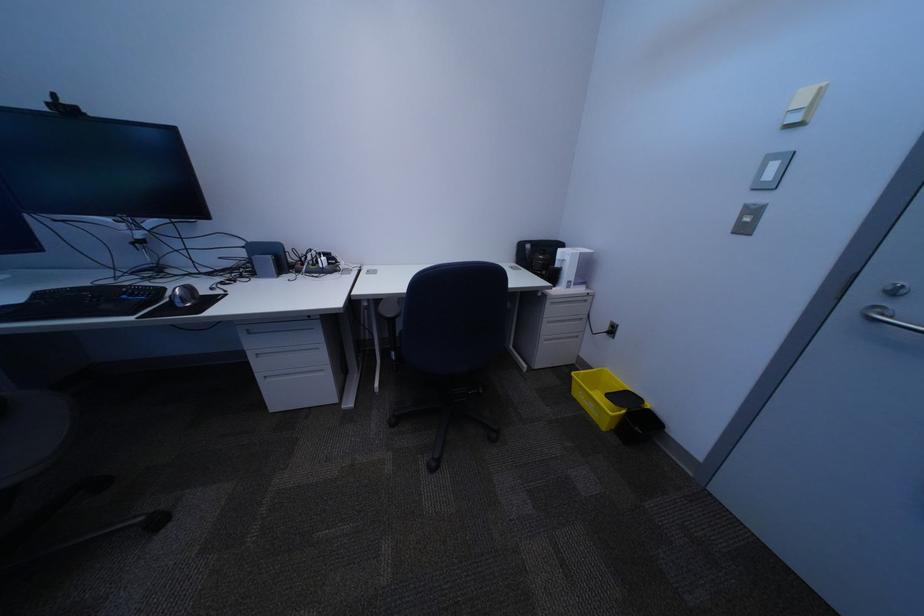
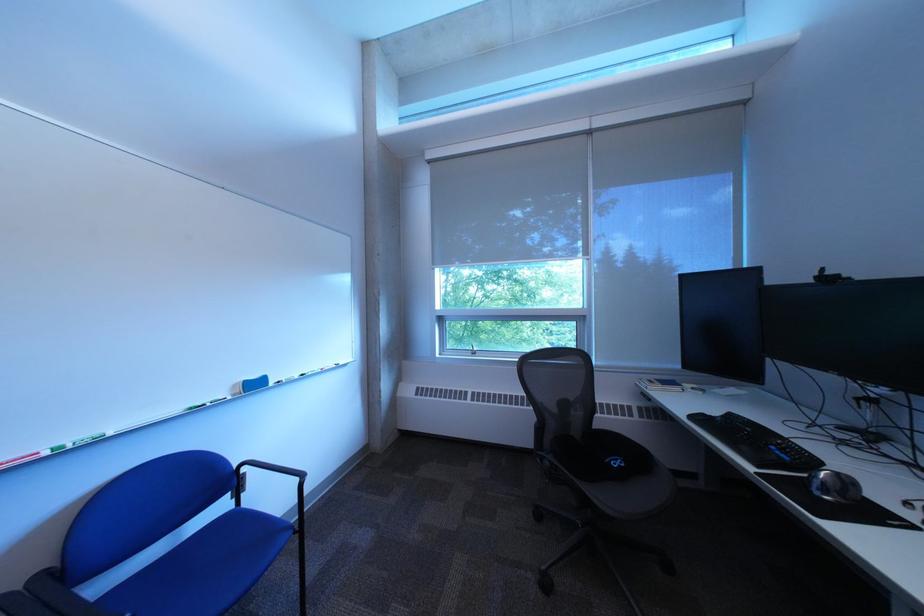
Locate, in the second image, the point that corresponds to (x=200, y=302) in the first image.

(841, 493)